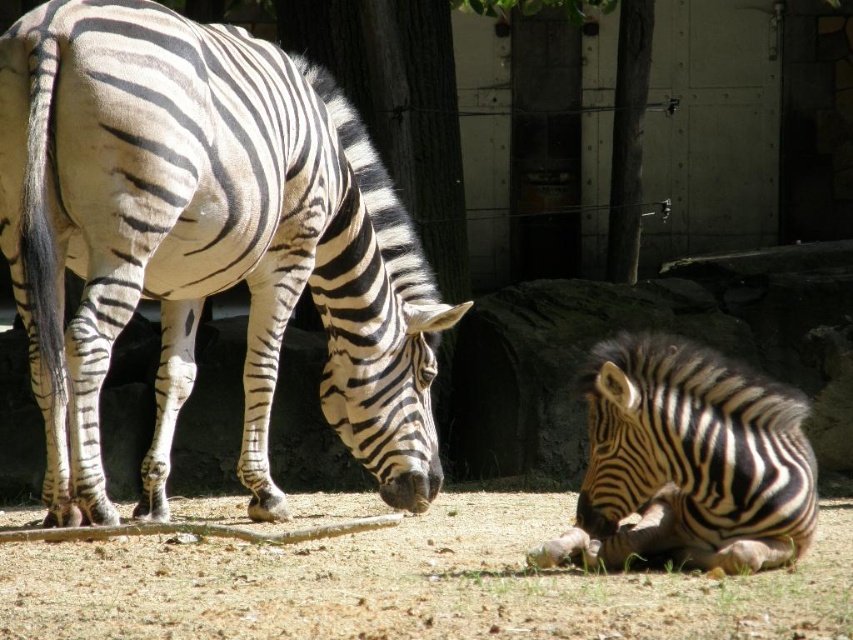
From the picture: You are a zookeeper observing the enclosure. You need to determine if the black and white striped zebra at left is standing on the green grass at lower center. Based on the scene, can you confirm this?

The black and white striped zebra at left is located above green grass at lower center, so it is standing on the green grass at lower center.

You are standing at the point marked by coordinates point [412,586]. Looking around, you see two zebras in the zoo enclosure. Which direction should you move to reach the nearest zebra?

The nearest zebra is the zebra on the right side of the frame lying down, so you should move towards the right side of the frame to reach it.